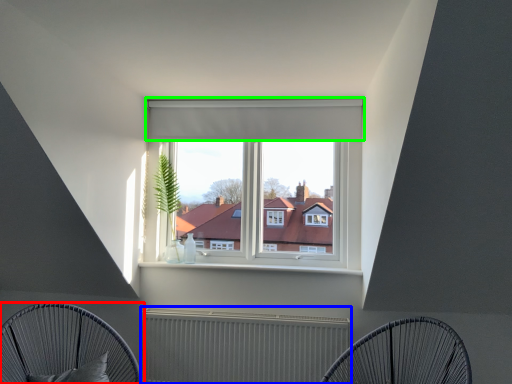
Question: Based on their relative distances, which object is farther from furniture (highlighted by a red box)? Choose from radiator (highlighted by a blue box) and curtain (highlighted by a green box).

Choices:
 (A) radiator
 (B) curtain

Answer: (B)